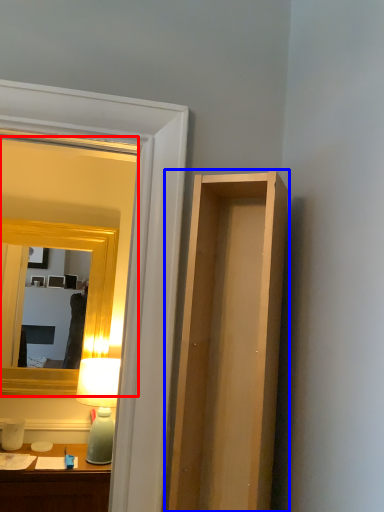
Question: Among these objects, which one is nearest to the camera, mirror (highlighted by a red box) or cabinet (highlighted by a blue box)?

Choices:
 (A) mirror
 (B) cabinet

Answer: (B)